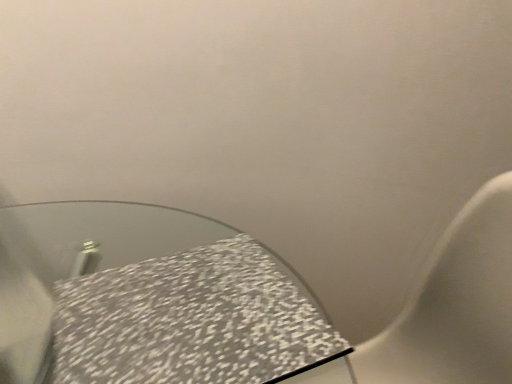
Question: Should I look upward or downward to see speckled fabric tablecloth at lower left?

Choices:
 (A) down
 (B) up

Answer: (A)

Question: From the image's perspective, is speckled fabric tablecloth at lower left under speckled ceramic toilet at lower left?

Choices:
 (A) yes
 (B) no

Answer: (B)

Question: Is speckled fabric tablecloth at lower left touching speckled ceramic toilet at lower left?

Choices:
 (A) yes
 (B) no

Answer: (B)

Question: Is there a large distance between speckled fabric tablecloth at lower left and speckled ceramic toilet at lower left?

Choices:
 (A) yes
 (B) no

Answer: (B)

Question: Does speckled fabric tablecloth at lower left contain speckled ceramic toilet at lower left?

Choices:
 (A) yes
 (B) no

Answer: (B)

Question: From a real-world perspective, is speckled fabric tablecloth at lower left below speckled ceramic toilet at lower left?

Choices:
 (A) no
 (B) yes

Answer: (A)

Question: Can we say speckled fabric tablecloth at lower left lies outside speckled ceramic toilet at lower left?

Choices:
 (A) yes
 (B) no

Answer: (B)

Question: Is speckled ceramic toilet at lower left closer to camera compared to speckled fabric tablecloth at lower left?

Choices:
 (A) no
 (B) yes

Answer: (B)

Question: Can we say speckled ceramic toilet at lower left lies outside speckled fabric tablecloth at lower left?

Choices:
 (A) yes
 (B) no

Answer: (A)

Question: Is speckled ceramic toilet at lower left positioned with its back to speckled fabric tablecloth at lower left?

Choices:
 (A) no
 (B) yes

Answer: (A)

Question: Does speckled ceramic toilet at lower left have a lesser height compared to speckled fabric tablecloth at lower left?

Choices:
 (A) yes
 (B) no

Answer: (B)

Question: From a real-world perspective, does speckled ceramic toilet at lower left sit lower than speckled fabric tablecloth at lower left?

Choices:
 (A) no
 (B) yes

Answer: (B)

Question: Is speckled ceramic toilet at lower left touching speckled fabric tablecloth at lower left?

Choices:
 (A) no
 (B) yes

Answer: (A)

Question: From the image's perspective, is speckled fabric tablecloth at lower left positioned above or below speckled ceramic toilet at lower left?

Choices:
 (A) above
 (B) below

Answer: (A)